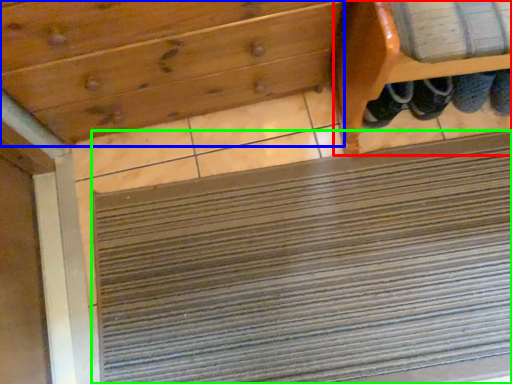
Question: Which object is the farthest from furniture (highlighted by a red box)? Choose among these: drawer (highlighted by a blue box) or doormat (highlighted by a green box).

Choices:
 (A) drawer
 (B) doormat

Answer: (B)